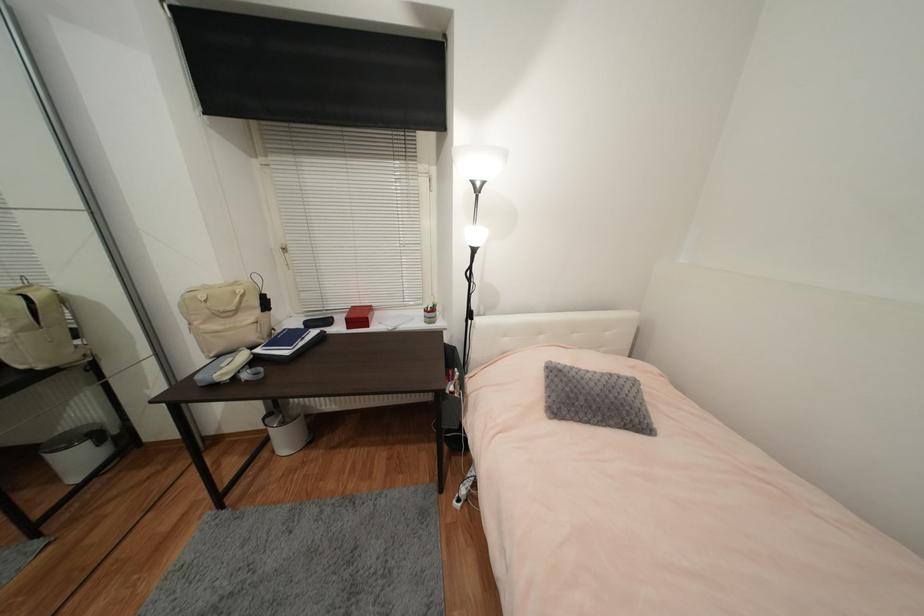
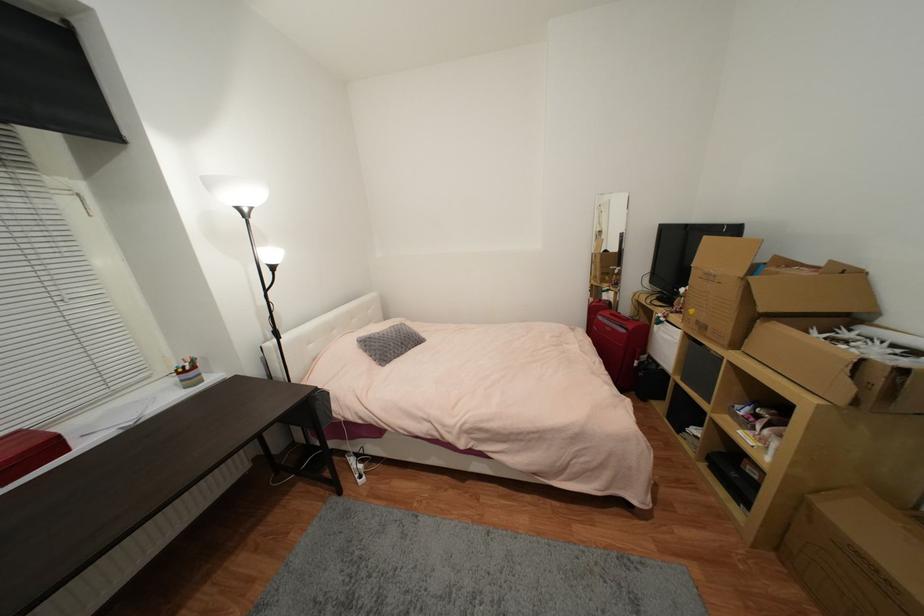
Question: Based on the continuous images, in which direction is the camera rotating? Reply with the corresponding letter.

Choices:
 (A) Left
 (B) Right
 (C) Up
 (D) Down

Answer: (B)